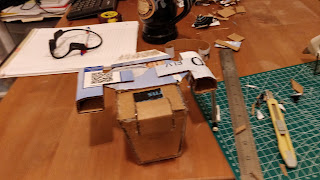
This screenshot has height=180, width=320. Find the location of `mug`. mug is located at coordinates (160, 24).